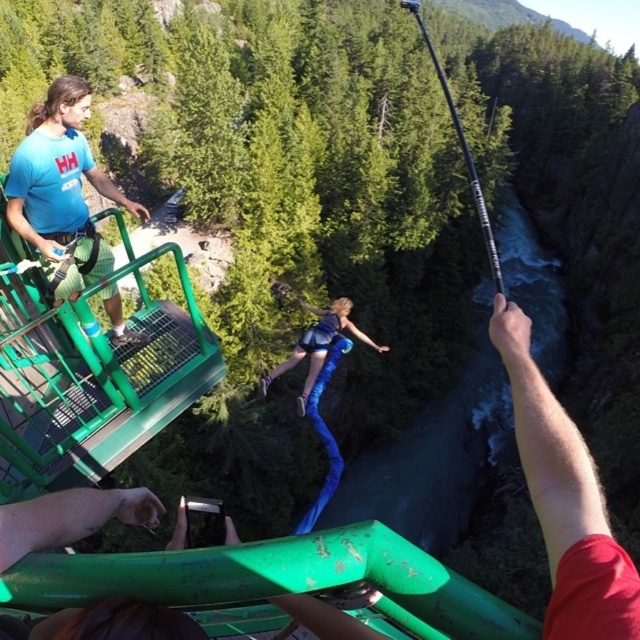
You are standing at the edge of the bungee platform and see two points marked in the scene. Which point, point (70, 204) or point (301, 342), is closer to your current position?

Point (70, 204) is closer to the camera than point (301, 342), so it is closer to your current position.